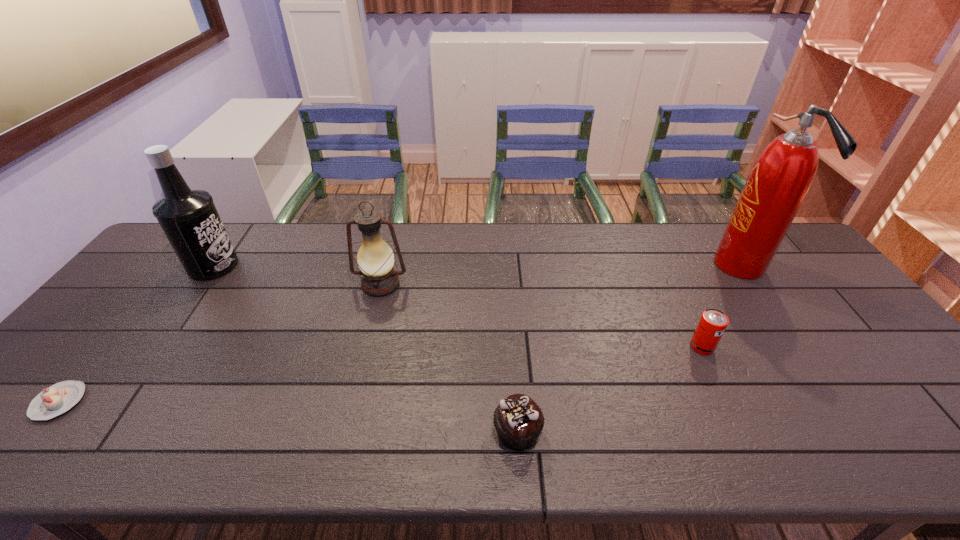
You are a GUI agent. You are given a task and a screenshot of the screen. Output one action in this format:
    pyautogui.click(x=<x>, y=<y>)
    Task: Click on the object that is at the near edge
    The height and width of the screenshot is (540, 960).
    Given the screenshot: What is the action you would take?
    pyautogui.click(x=518, y=420)

The height and width of the screenshot is (540, 960). What are the coordinates of `liquor located at the left edge` in the screenshot? It's located at (188, 217).

This screenshot has height=540, width=960. I want to click on cupcake that is at the left edge, so click(57, 399).

Where is `object at the right edge`? object at the right edge is located at coordinates (781, 177).

Find the location of a particular element. object that is at the far left corner is located at coordinates (188, 217).

The image size is (960, 540). Find the location of `object located in the far right corner section of the desktop`. object located in the far right corner section of the desktop is located at coordinates (781, 177).

Locate an element on the screen. vacant space at the far edge is located at coordinates click(x=701, y=232).

You are a GUI agent. You are given a task and a screenshot of the screen. Output one action in this format:
    pyautogui.click(x=<x>, y=<y>)
    Task: Click on the free space at the near edge of the desktop
    
    Given the screenshot: What is the action you would take?
    pyautogui.click(x=298, y=448)

Where is `vacant space at the left edge of the desktop`? The height and width of the screenshot is (540, 960). vacant space at the left edge of the desktop is located at coordinates (96, 333).

You are a GUI agent. You are given a task and a screenshot of the screen. Output one action in this format:
    pyautogui.click(x=<x>, y=<y>)
    Task: Click on the vacant space at the right edge
    This screenshot has width=960, height=540.
    Given the screenshot: What is the action you would take?
    pyautogui.click(x=816, y=307)